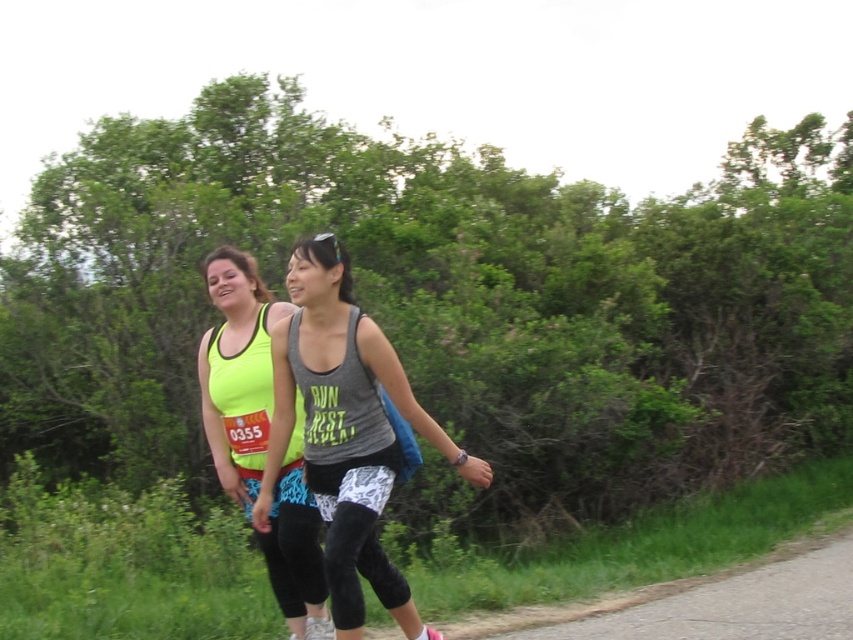
Question: Which point appears farthest from the camera in this image?

Choices:
 (A) coord(762,588)
 (B) coord(357,595)

Answer: (A)

Question: Is neon yellow tank top at center to the right of gravel road at lower right from the viewer's perspective?

Choices:
 (A) no
 (B) yes

Answer: (A)

Question: Based on their relative distances, which object is nearer to the gray matte tank top at center?

Choices:
 (A) gravel road at lower right
 (B) neon yellow tank top at center

Answer: (B)

Question: Observing the image, what is the correct spatial positioning of gray matte tank top at center in reference to neon yellow tank top at center?

Choices:
 (A) left
 (B) right

Answer: (B)

Question: Which object is closer to the camera taking this photo?

Choices:
 (A) gravel road at lower right
 (B) gray matte tank top at center
 (C) neon yellow tank top at center

Answer: (B)

Question: Can you confirm if neon yellow tank top at center is smaller than gravel road at lower right?

Choices:
 (A) no
 (B) yes

Answer: (B)